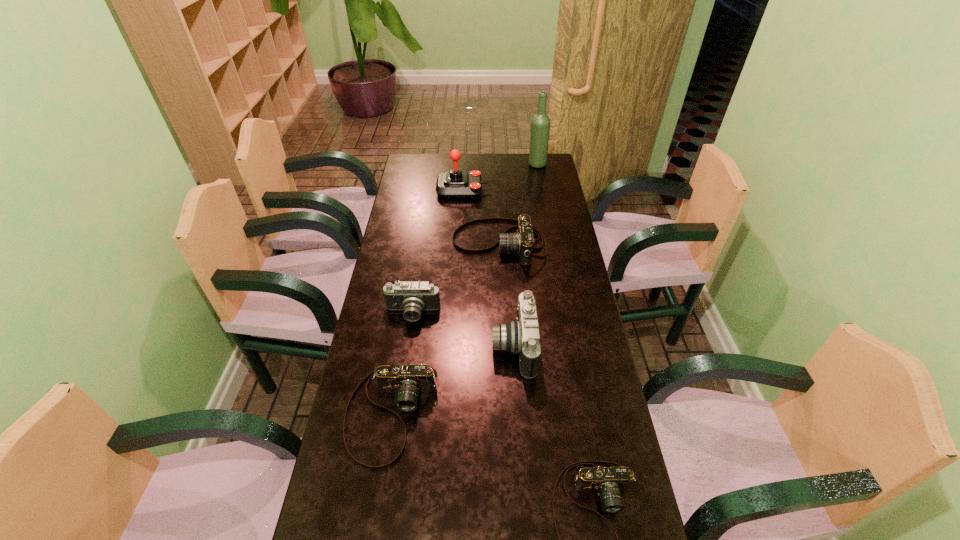
The height and width of the screenshot is (540, 960). What are the coordinates of `the fourth tallest camera` in the screenshot? It's located at (407, 381).

Find the location of a particular element. The width and height of the screenshot is (960, 540). vacant region located 0.380m on the front of the farthest object is located at coordinates (546, 216).

Identify the location of vacant space located 0.160m on the base of the joystick. (523, 190).

This screenshot has height=540, width=960. In order to click on free space located on the front-facing side of the right black camera in this screenshot , I will do click(401, 347).

Locate an element on the screen. vacant area situated 0.400m on the front-facing side of the right black camera is located at coordinates (362, 347).

You are a GUI agent. You are given a task and a screenshot of the screen. Output one action in this format:
    pyautogui.click(x=<x>, y=<y>)
    Task: Click on the vacant region located on the front-facing side of the right black camera
    
    Given the screenshot: What is the action you would take?
    pyautogui.click(x=378, y=347)

The width and height of the screenshot is (960, 540). Identify the location of vacant region located on the front-facing side of the left black camera. (396, 424).

Locate an element on the screen. The width and height of the screenshot is (960, 540). free space located 0.160m on the front-facing side of the biggest brown camera is located at coordinates (411, 243).

I want to click on vacant space located on the front-facing side of the biggest brown camera, so click(411, 243).

Locate an element on the screen. free space located on the front-facing side of the biggest brown camera is located at coordinates (440, 243).